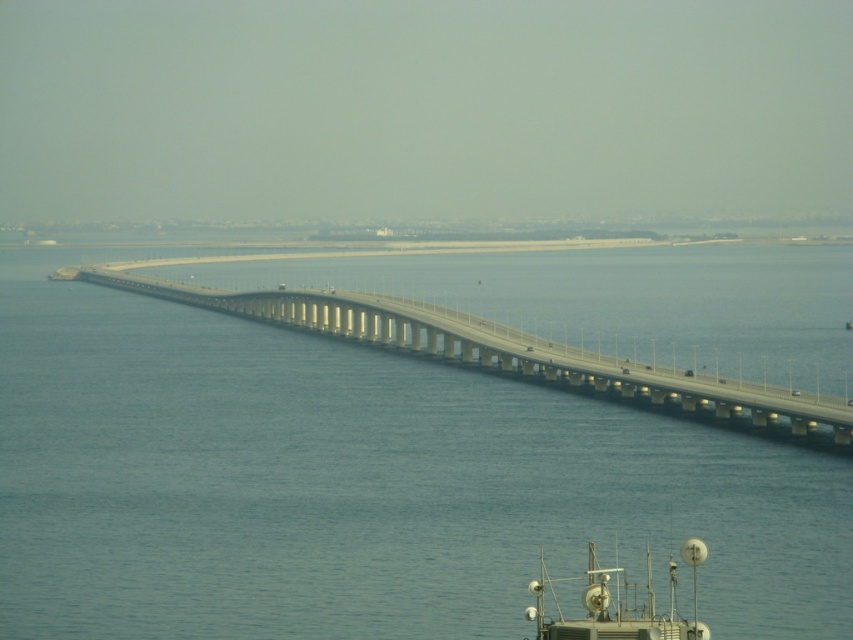
You are a photographer planning to capture a wide shot of the concrete bridge at center and the metallic gray satellite dish at lower right. Given their sizes, which object will occupy more space in your photo?

The concrete bridge at center is larger in size than the metallic gray satellite dish at lower right, so it will occupy more space in the photo.

You are standing on the shore and looking at the blue water at center and the concrete bridge at center. Which object is nearer to you?

The blue water at center is closer to the viewer than the concrete bridge at center.